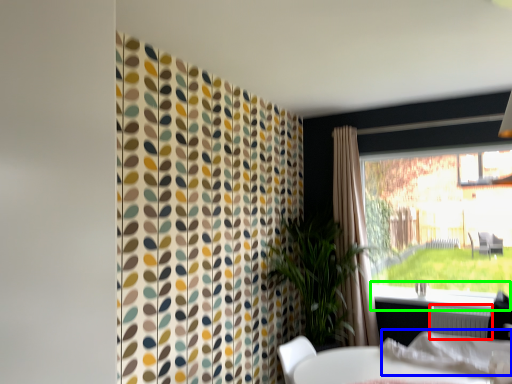
Question: Which object is positioned closest to radiator (highlighted by a red box)? Select from linen (highlighted by a blue box) and window sill (highlighted by a green box).

Choices:
 (A) linen
 (B) window sill

Answer: (B)